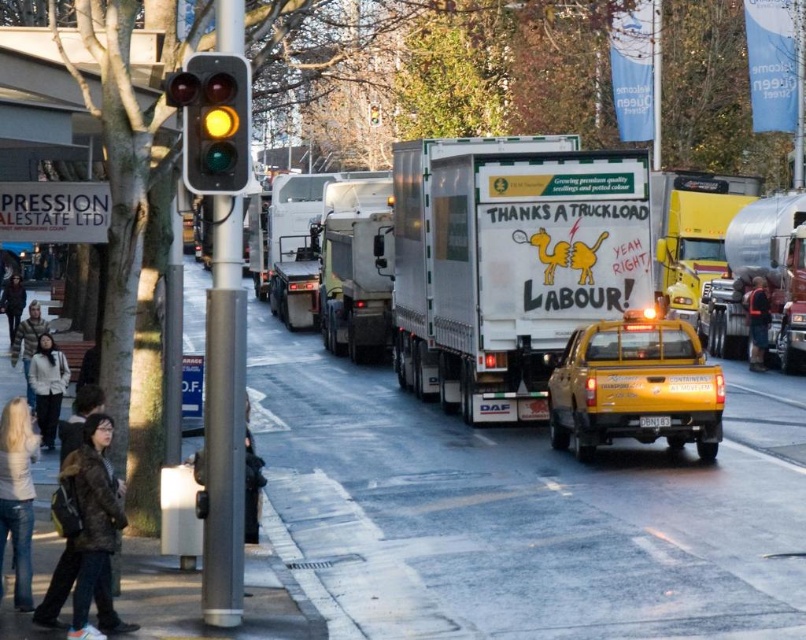
Between white glossy truck at center and brown fabric backpack at lower left, which one appears on the right side from the viewer's perspective?

white glossy truck at center is more to the right.

Between white glossy truck at center and brown fabric backpack at lower left, which one has more height?

white glossy truck at center

Measure the distance between point (x=347, y=237) and camera.

They are 33.11 meters apart.

Where is `white glossy truck at center`? This screenshot has width=806, height=640. white glossy truck at center is located at coordinates (354, 268).

Can you confirm if white fleece jacket at lower left is bigger than dark brown leather jacket at lower left?

Actually, white fleece jacket at lower left might be smaller than dark brown leather jacket at lower left.

Is white fleece jacket at lower left to the right of dark brown leather jacket at lower left from the viewer's perspective?

Yes, white fleece jacket at lower left is to the right of dark brown leather jacket at lower left.

In order to click on white fleece jacket at lower left in this screenshot , I will do coord(48,387).

Is point (19, 332) positioned behind point (15, 292)?

That is False.

Which is more to the left, light brown leather jacket at lower left or dark brown leather jacket at lower left?

dark brown leather jacket at lower left

Locate an element on the screen. light brown leather jacket at lower left is located at coordinates (28, 346).

The width and height of the screenshot is (806, 640). In order to click on light brown leather jacket at lower left in this screenshot , I will do `click(28, 346)`.